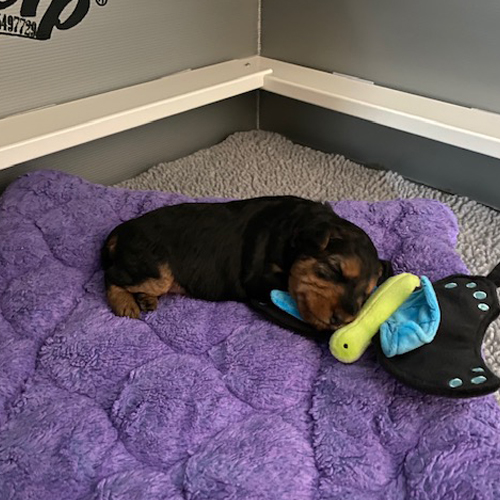
I want to click on bed behind dog, so click(x=165, y=198).